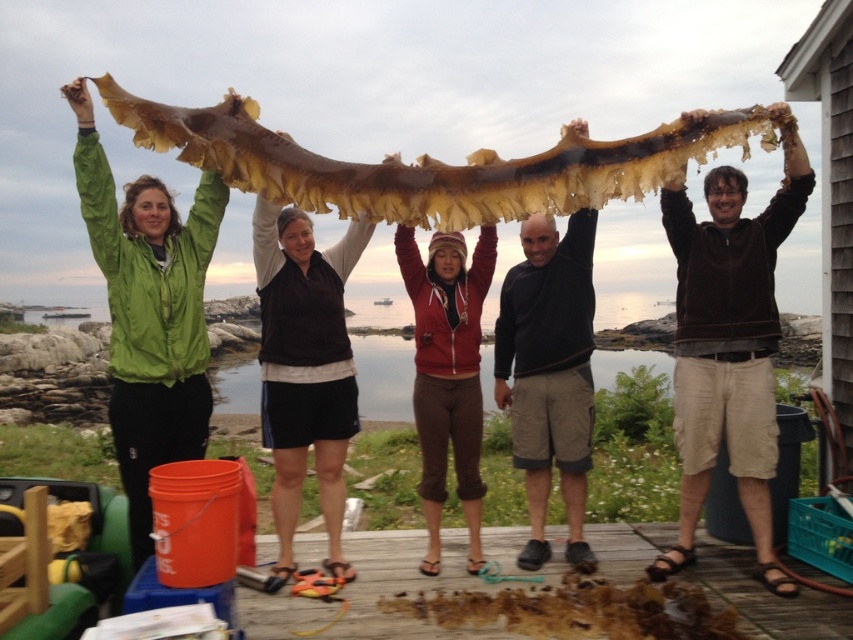
You are standing on the wooden deck and want to hand a small note to both the person wearing the brown fuzzy sweater at upper right and the person wearing the dark gray sweater at center. Which person should you approach first based on their position?

You should approach the person wearing the brown fuzzy sweater at upper right first because they are closer to you than the dark gray sweater at center, who is further away.

Consider the image. You are standing on the wooden deck and want to place a small flag at the point closer to you between point (792, 154) and point (172, 221). Which point should you choose?

Point (792, 154) is closer to you than point (172, 221), so you should choose point (792, 154) to place the small flag.